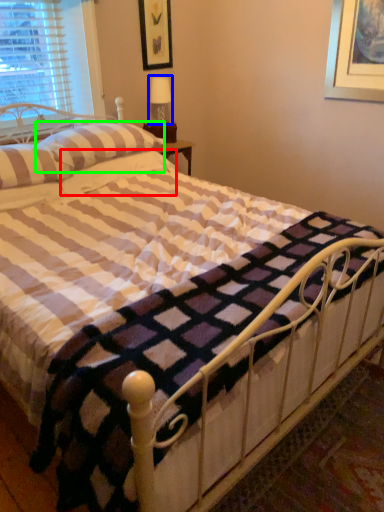
Question: Based on their relative distances, which object is nearer to pillow (highlighted by a red box)? Choose from table lamp (highlighted by a blue box) and pillow (highlighted by a green box).

Choices:
 (A) table lamp
 (B) pillow

Answer: (B)